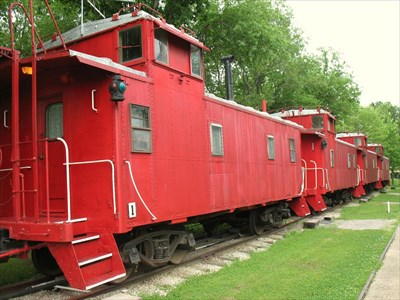
You are a GUI agent. You are given a task and a screenshot of the screen. Output one action in this format:
    pyautogui.click(x=<x>, y=<y>)
    Task: Click on the door
    The image size is (400, 300).
    Given the screenshot: What is the action you would take?
    pyautogui.click(x=55, y=158)